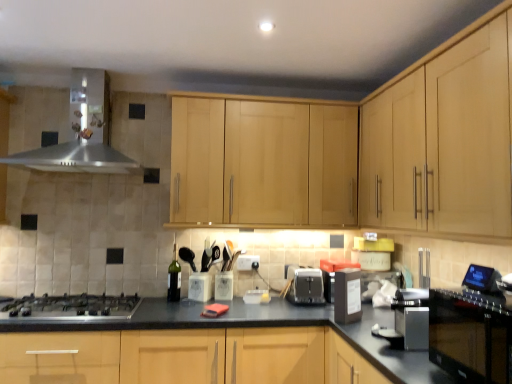
The image size is (512, 384). What do you see at coordinates (469, 337) in the screenshot?
I see `black glossy oven at lower right` at bounding box center [469, 337].

Image resolution: width=512 pixels, height=384 pixels. What do you see at coordinates (347, 296) in the screenshot? I see `black plastic container at center-right, the 2th appliance viewed from the left` at bounding box center [347, 296].

What is the approximate height of satin silver toaster at center, which is the 2th appliance from right to left?

satin silver toaster at center, which is the 2th appliance from right to left, is 18.98 centimeters tall.

The image size is (512, 384). Identify the location of light wood cabinet at center, the first cabinetry from the left. (263, 163).

Where is `black glossy oven at lower right`? Image resolution: width=512 pixels, height=384 pixels. black glossy oven at lower right is located at coordinates 469,337.

Is black plastic container at center-right, which appears as the 2th appliance when viewed from the back, in contact with green glass bottle at center?

There is a gap between black plastic container at center-right, which appears as the 2th appliance when viewed from the back, and green glass bottle at center.

Does black plastic container at center-right, marked as the first appliance in a front-to-back arrangement, have a greater width compared to green glass bottle at center?

Correct, the width of black plastic container at center-right, marked as the first appliance in a front-to-back arrangement, exceeds that of green glass bottle at center.

Considering the sizes of objects black plastic container at center-right, acting as the first appliance starting from the right, and green glass bottle at center in the image provided, who is smaller, black plastic container at center-right, acting as the first appliance starting from the right, or green glass bottle at center?

green glass bottle at center.

Is green glass bottle at center completely or partially inside black plastic container at center-right, acting as the first appliance starting from the right?

No, green glass bottle at center is not a part of black plastic container at center-right, acting as the first appliance starting from the right.

From a real-world perspective, is satin silver gas stove at lower left located higher than stainless steel range hood at upper left?

No, from a real-world perspective, satin silver gas stove at lower left is not above stainless steel range hood at upper left.

Can you confirm if satin silver gas stove at lower left is taller than stainless steel range hood at upper left?

Incorrect, the height of satin silver gas stove at lower left is not larger of that of stainless steel range hood at upper left.

Is satin silver gas stove at lower left aimed at stainless steel range hood at upper left?

No, satin silver gas stove at lower left is not turned towards stainless steel range hood at upper left.

Does satin silver gas stove at lower left have a smaller size compared to stainless steel range hood at upper left?

Yes, satin silver gas stove at lower left is smaller than stainless steel range hood at upper left.

Is point (489, 54) closer to viewer compared to point (445, 296)?

Yes, point (489, 54) is closer to viewer.

Who is bigger, light wood cabinet at upper right, the first cabinetry in the right-to-left sequence, or black glossy oven at lower right?

light wood cabinet at upper right, the first cabinetry in the right-to-left sequence.

Is light wood cabinet at upper right, which ranks as the second cabinetry in left-to-right order, oriented away from black glossy oven at lower right?

No, light wood cabinet at upper right, which ranks as the second cabinetry in left-to-right order, is not facing the opposite direction of black glossy oven at lower right.

Is black glossy oven at lower right surrounded by light wood cabinet at upper right, which ranks as the second cabinetry in left-to-right order?

No, black glossy oven at lower right is located outside of light wood cabinet at upper right, which ranks as the second cabinetry in left-to-right order.

Which is more to the left, black plastic container at center-right, acting as the first appliance starting from the right, or black glossy oven at lower right?

From the viewer's perspective, black plastic container at center-right, acting as the first appliance starting from the right, appears more on the left side.

Which object is more forward, black plastic container at center-right, marked as the first appliance in a front-to-back arrangement, or black glossy oven at lower right?

black glossy oven at lower right is closer to the camera.

Can you confirm if black plastic container at center-right, marked as the first appliance in a front-to-back arrangement, is taller than black glossy oven at lower right?

No.

Could you tell me if black plastic container at center-right, acting as the first appliance starting from the right, is turned towards black glossy oven at lower right?

No, black plastic container at center-right, acting as the first appliance starting from the right, is not facing towards black glossy oven at lower right.

From the picture: Is black glossy oven at lower right far from satin silver gas stove at lower left?

black glossy oven at lower right is positioned a significant distance from satin silver gas stove at lower left.

Is black glossy oven at lower right in front of or behind satin silver gas stove at lower left in the image?

Visually, black glossy oven at lower right is located in front of satin silver gas stove at lower left.

Based on the photo, can you confirm if black glossy oven at lower right is smaller than satin silver gas stove at lower left?

Actually, black glossy oven at lower right might be larger than satin silver gas stove at lower left.

How different are the orientations of black glossy oven at lower right and satin silver gas stove at lower left in degrees?

90.5 degrees separate the facing orientations of black glossy oven at lower right and satin silver gas stove at lower left.

From the image's perspective, which is above, black plastic container at center-right, the 2th appliance viewed from the left, or light wood cabinet at upper right, the first cabinetry in the right-to-left sequence?

light wood cabinet at upper right, the first cabinetry in the right-to-left sequence, from the image's perspective.

Is black plastic container at center-right, which appears as the 2th appliance when viewed from the back, facing away from light wood cabinet at upper right, which ranks as the second cabinetry in left-to-right order?

No, black plastic container at center-right, which appears as the 2th appliance when viewed from the back, is not facing away from light wood cabinet at upper right, which ranks as the second cabinetry in left-to-right order.

Does black plastic container at center-right, marked as the first appliance in a front-to-back arrangement, touch light wood cabinet at upper right, the first cabinetry in the right-to-left sequence?

No, black plastic container at center-right, marked as the first appliance in a front-to-back arrangement, is not beside light wood cabinet at upper right, the first cabinetry in the right-to-left sequence.

Does black plastic container at center-right, marked as the first appliance in a front-to-back arrangement, have a greater height compared to satin silver toaster at center, which is the 2th appliance from right to left?

Correct, black plastic container at center-right, marked as the first appliance in a front-to-back arrangement, is much taller as satin silver toaster at center, which is the 2th appliance from right to left.

This screenshot has height=384, width=512. What are the coordinates of `appliance lying in front of the satin silver toaster at center, which is the 1th appliance in left-to-right order` in the screenshot? It's located at (347, 296).

Looking at this image, is black plastic container at center-right, acting as the first appliance starting from the right, facing towards satin silver toaster at center, which is the 1th appliance in left-to-right order?

No, black plastic container at center-right, acting as the first appliance starting from the right, is not turned towards satin silver toaster at center, which is the 1th appliance in left-to-right order.

Is point (343, 288) more distant than point (314, 292)?

No, it is in front of (314, 292).

Identify the location of bottle above the black plastic container at center-right, which appears as the 2th appliance when viewed from the back (from the image's perspective). (174, 278).

Locate an element on the screen. The height and width of the screenshot is (384, 512). home appliance that appears above the satin silver gas stove at lower left (from a real-world perspective) is located at coordinates (82, 133).

When comparing their distances from stainless steel range hood at upper left, does satin silver toaster at center, which is the 2th appliance from right to left, or green glass bottle at center seem closer?

green glass bottle at center is closer to stainless steel range hood at upper left.

Considering their positions, is light wood cabinet at upper right, which ranks as the second cabinetry in left-to-right order, positioned closer to black glossy oven at lower right than satin silver toaster at center, the first appliance in the back-to-front sequence?

Based on the image, light wood cabinet at upper right, which ranks as the second cabinetry in left-to-right order, appears to be nearer to black glossy oven at lower right.

Based on their spatial positions, is satin silver toaster at center, which is the 2th appliance from right to left, or black plastic container at center-right, marked as the first appliance in a front-to-back arrangement, closer to green glass bottle at center?

satin silver toaster at center, which is the 2th appliance from right to left.

When comparing their distances from stainless steel range hood at upper left, does green glass bottle at center or black glossy oven at lower right seem further?

black glossy oven at lower right is further to stainless steel range hood at upper left.

Considering their positions, is stainless steel range hood at upper left positioned further to satin silver toaster at center, which is the 2th appliance from right to left, than black glossy oven at lower right?

stainless steel range hood at upper left lies further to satin silver toaster at center, which is the 2th appliance from right to left, than the other object.

Estimate the real-world distances between objects in this image. Which object is further from black granite countertop at center, light wood cabinet at center, the first cabinetry from the left, or black glossy oven at lower right?

light wood cabinet at center, the first cabinetry from the left.

From the image, which object appears to be farther from light wood cabinet at upper right, the first cabinetry in the right-to-left sequence, black glossy oven at lower right or satin silver gas stove at lower left?

satin silver gas stove at lower left is positioned further to the anchor light wood cabinet at upper right, the first cabinetry in the right-to-left sequence.

From the image, which object appears to be farther from satin silver gas stove at lower left, stainless steel range hood at upper left or light wood cabinet at center, the first cabinetry from the left?

light wood cabinet at center, the first cabinetry from the left, is further to satin silver gas stove at lower left.

Where is `gas stove between stainless steel range hood at upper left and black granite countertop at center vertically`? The image size is (512, 384). gas stove between stainless steel range hood at upper left and black granite countertop at center vertically is located at coordinates (71, 306).

You are a GUI agent. You are given a task and a screenshot of the screen. Output one action in this format:
    pyautogui.click(x=<x>, y=<y>)
    Task: Click on the cabinetry situated between stainless steel range hood at upper left and black glossy oven at lower right from left to right
    
    Given the screenshot: What is the action you would take?
    tap(263, 163)

The image size is (512, 384). I want to click on bottle between stainless steel range hood at upper left and satin silver toaster at center, marked as the 2th appliance in a front-to-back arrangement, from left to right, so click(174, 278).

Where is `countertop between green glass bottle at center and light wood cabinet at upper right, which ranks as the second cabinetry in left-to-right order`? The height and width of the screenshot is (384, 512). countertop between green glass bottle at center and light wood cabinet at upper right, which ranks as the second cabinetry in left-to-right order is located at coordinates (261, 326).